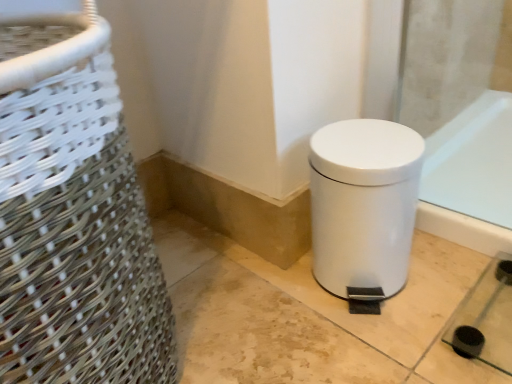
Question: Considering the positions of point (374, 162) and point (147, 369), is point (374, 162) closer or farther from the camera than point (147, 369)?

Choices:
 (A) closer
 (B) farther

Answer: (B)

Question: Considering the positions of white matte waste container at lower right and white woven basket at left in the image, is white matte waste container at lower right wider or thinner than white woven basket at left?

Choices:
 (A) wide
 (B) thin

Answer: (B)

Question: Considering the positions of white matte waste container at lower right and white woven basket at left in the image, is white matte waste container at lower right taller or shorter than white woven basket at left?

Choices:
 (A) tall
 (B) short

Answer: (B)

Question: In terms of width, does white woven basket at left look wider or thinner when compared to white matte waste container at lower right?

Choices:
 (A) thin
 (B) wide

Answer: (B)

Question: Considering the positions of point (44, 167) and point (388, 175), is point (44, 167) closer or farther from the camera than point (388, 175)?

Choices:
 (A) closer
 (B) farther

Answer: (A)

Question: In terms of size, does white woven basket at left appear bigger or smaller than white matte waste container at lower right?

Choices:
 (A) small
 (B) big

Answer: (B)

Question: Would you say white woven basket at left is inside or outside white matte waste container at lower right?

Choices:
 (A) inside
 (B) outside

Answer: (B)